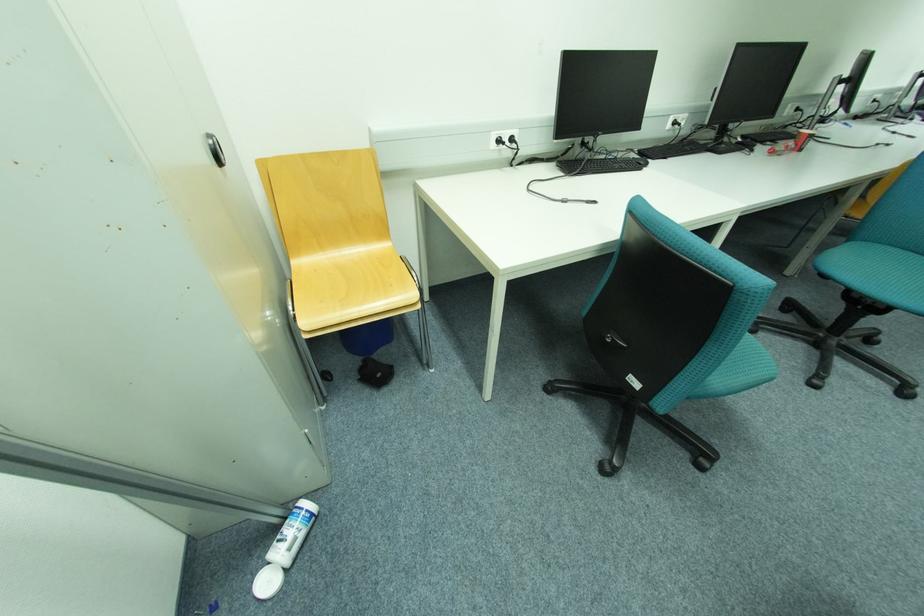
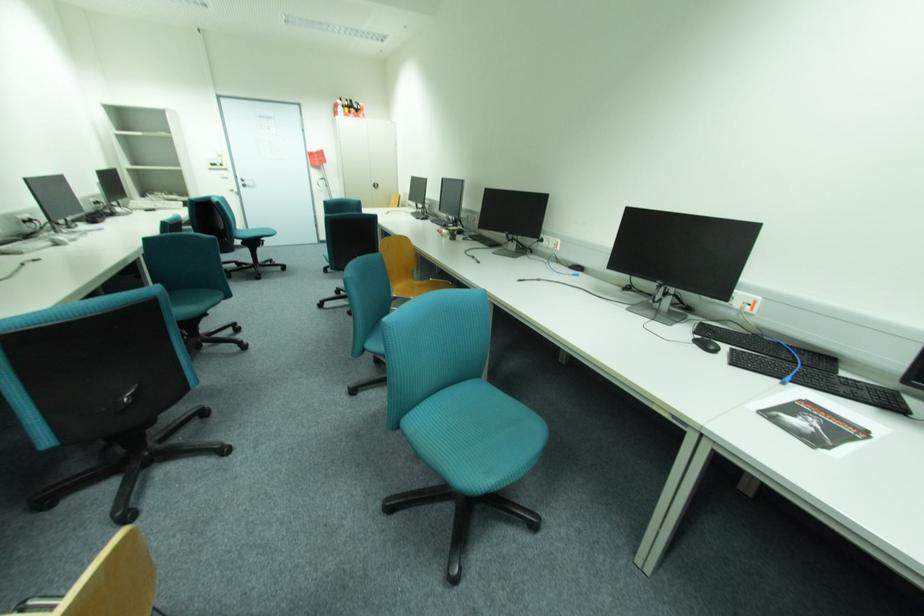
Question: I am providing you with two images of the same scene from different viewpoints. Please identify which objects are invisible in image2.

Choices:
 (A) silver door handle
 (B) light blue bottle
 (C) white bottle cap
 (D) printed paper document

Answer: (C)